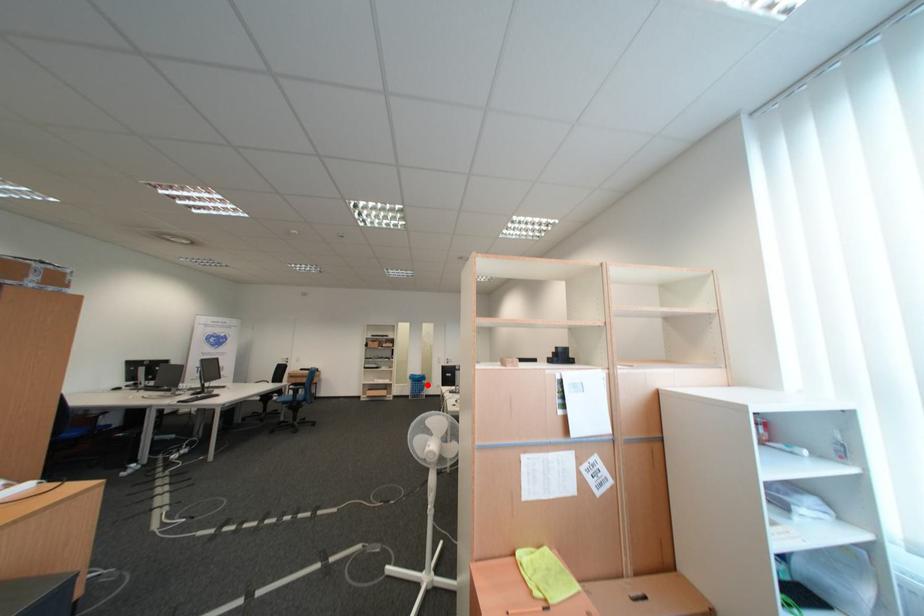
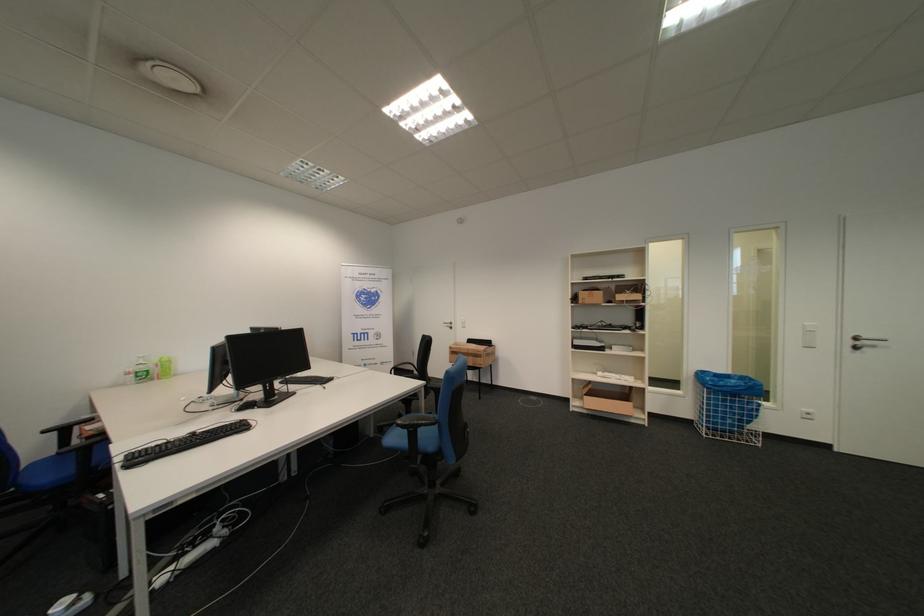
Where in the second image is the point corresponding to the highlighted location from the first image?

(736, 402)